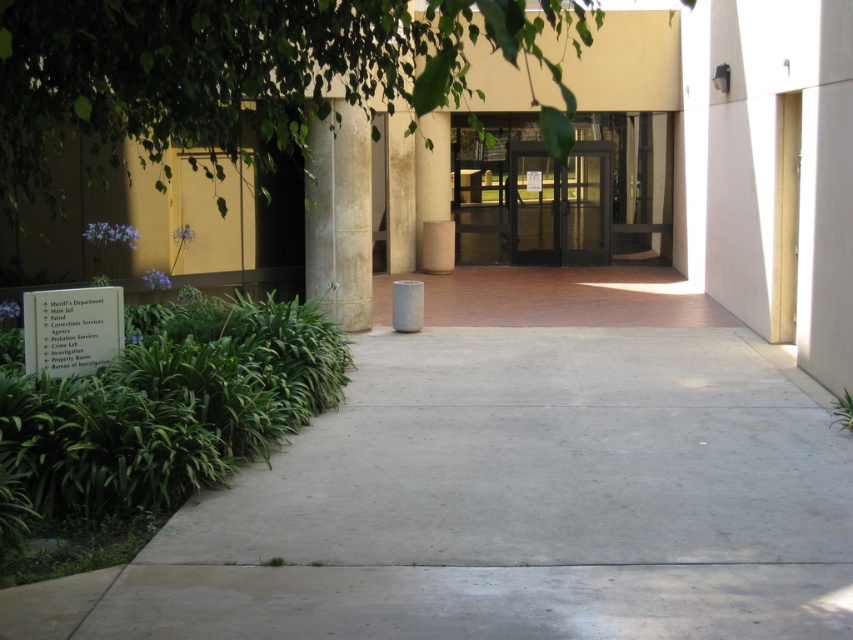
You are a delivery person approaching the entrance of the building. You need to deliver a package through the transparent glass doors at center. However, there is a white stone pillar at center in your path. Based on the scene description, can you pass through the doors without moving the pillar?

The white stone pillar at center is to the left of transparent glass doors at center, so you can pass through the transparent glass doors at center by moving to the right side of the pillar since it is not blocking the entrance directly in front.

You are a delivery person trying to enter the building through the entrance. You have a large cart that is 1 meter wide. Can you fit through the space between the white stone pillar at center and the transparent glass doors at center?

The white stone pillar at center is thinner than transparent glass doors at center, so the space between them is wider than the pillar. However, since the pillar is thinner, the available space might still be narrower than the cart. Without knowing the exact width of the pillar or the doors, it is impossible to determine if the cart will fit. Please measure the space before attempting to pass through.

You are standing at the entrance of the building and see the point marked at coordinates (563, 192). What does this point indicate?

The point at coordinates (563, 192) marks the location of the black glass doors at center.